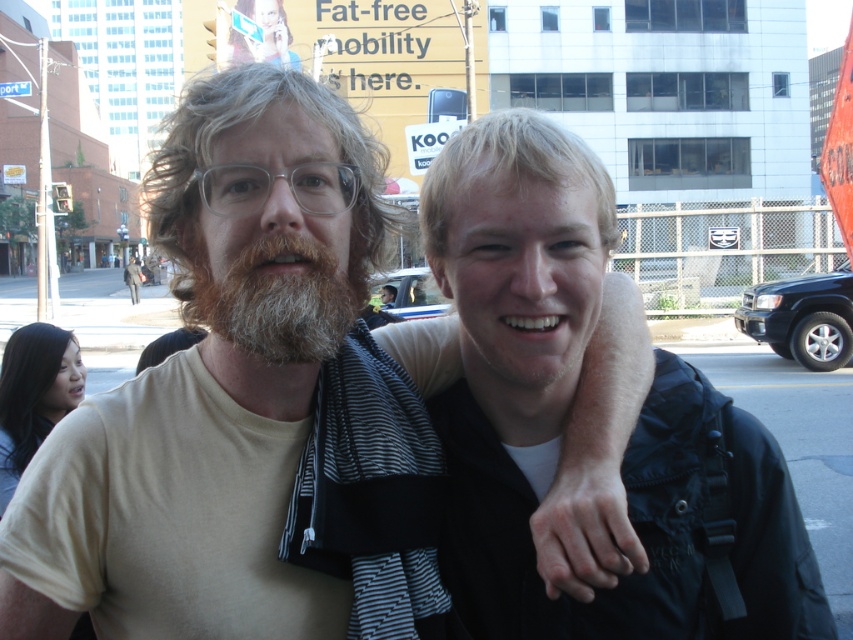
Question: Is the position of black fabric backpack at center more distant than that of brown fuzzy beard at center?

Choices:
 (A) no
 (B) yes

Answer: (B)

Question: Which object appears farthest from the camera in this image?

Choices:
 (A) light beige t-shirt at center
 (B) black fabric backpack at center
 (C) brown fuzzy beard at center

Answer: (B)

Question: Which of the following is the farthest from the observer?

Choices:
 (A) light beige t-shirt at center
 (B) black fabric backpack at center

Answer: (B)

Question: Does light beige t-shirt at center appear over brown fuzzy beard at center?

Choices:
 (A) yes
 (B) no

Answer: (B)

Question: Does black fabric backpack at center appear on the right side of brown fuzzy beard at center?

Choices:
 (A) no
 (B) yes

Answer: (B)

Question: Estimate the real-world distances between objects in this image. Which object is farther from the brown fuzzy beard at center?

Choices:
 (A) light beige t-shirt at center
 (B) black fabric backpack at center

Answer: (B)